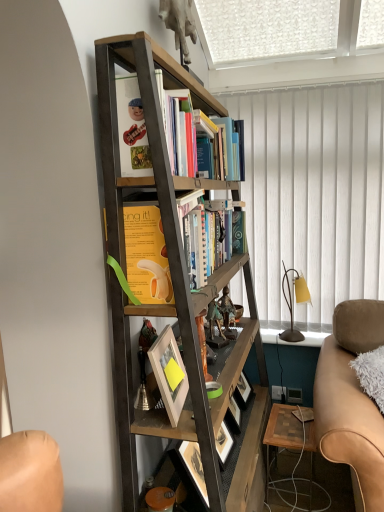
This screenshot has height=512, width=384. Describe the element at coordinates (314, 194) in the screenshot. I see `white textured curtain at upper right` at that location.

The height and width of the screenshot is (512, 384). Identify the location of metallic figurine at center, which is the first toy in back-to-front order. (226, 309).

What do you see at coordinates (226, 309) in the screenshot? The width and height of the screenshot is (384, 512). I see `metallic figurine at center, arranged as the second toy when viewed from the front` at bounding box center [226, 309].

Find the location of a particular element. metallic bookcase at center is located at coordinates (173, 284).

This screenshot has height=512, width=384. I want to click on white textured curtain at upper right, so click(314, 194).

Which is closer, (205, 434) or (328, 448)?

The point (205, 434) is in front.

Which of these two, metallic bookcase at center or suede tan couch at lower right, is smaller?

suede tan couch at lower right is smaller.

Which of these two, metallic bookcase at center or suede tan couch at lower right, stands taller?

With more height is metallic bookcase at center.

Is metallic bookcase at center facing towards suede tan couch at lower right?

Yes, metallic bookcase at center is aimed at suede tan couch at lower right.

From a real-world perspective, between brown matte table lamp at right and white textured curtain at upper right, who is vertically higher?

white textured curtain at upper right is physically above.

In the scene shown: Between brown matte table lamp at right and white textured curtain at upper right, which one appears on the right side from the viewer's perspective?

white textured curtain at upper right.

From the image's perspective, which is above, brown matte table lamp at right or white textured curtain at upper right?

white textured curtain at upper right is shown above in the image.

Choose the correct answer: Is brown matte table lamp at right inside white textured curtain at upper right or outside it?

The correct answer is: outside.

How many degrees apart are the facing directions of white textured curtain at upper right and white matte picture frame at center?

The facing directions of white textured curtain at upper right and white matte picture frame at center are 97.1 degrees apart.

Considering the relative sizes of white textured curtain at upper right and white matte picture frame at center in the image provided, is white textured curtain at upper right smaller than white matte picture frame at center?

Actually, white textured curtain at upper right might be larger than white matte picture frame at center.

Considering the sizes of objects white textured curtain at upper right and white matte picture frame at center in the image provided, who is shorter, white textured curtain at upper right or white matte picture frame at center?

white matte picture frame at center.

Choose the correct answer: Is white textured curtain at upper right inside white matte picture frame at center or outside it?

white textured curtain at upper right lies outside white matte picture frame at center.

Does point (141, 227) come closer to viewer compared to point (291, 300)?

Yes.

Looking at the image, does yellow paperback book at center, the first book viewed from the front, seem bigger or smaller compared to brown matte table lamp at right?

Considering their sizes, yellow paperback book at center, the first book viewed from the front, takes up more space than brown matte table lamp at right.

From a real-world perspective, is yellow paperback book at center, positioned as the 3th book in back-to-front order, positioned above or below brown matte table lamp at right?

In terms of real-world spatial position, yellow paperback book at center, positioned as the 3th book in back-to-front order, is above brown matte table lamp at right.

From the image's perspective, which is below, yellow paperback book at center, the first book viewed from the front, or brown matte table lamp at right?

From the image's view, brown matte table lamp at right is below.

Measure the distance between white textured curtain at upper right and suede tan couch at lower right.

white textured curtain at upper right and suede tan couch at lower right are 28.72 inches apart.

Is white textured curtain at upper right wider than suede tan couch at lower right?

Incorrect, the width of white textured curtain at upper right does not surpass that of suede tan couch at lower right.

Does white textured curtain at upper right have a greater height compared to suede tan couch at lower right?

Correct, white textured curtain at upper right is much taller as suede tan couch at lower right.

From a real-world perspective, which object rests below the other?

From a 3D spatial view, suede tan couch at lower right is below.

Is point (194, 198) positioned before point (337, 353)?

Yes, point (194, 198) is closer to viewer.

How distant is yellow paperback book at center, positioned as the 3th book in back-to-front order, from suede tan couch at lower right?

36.42 inches.

Is yellow paperback book at center, positioned as the 3th book in back-to-front order, situated inside suede tan couch at lower right or outside?

yellow paperback book at center, positioned as the 3th book in back-to-front order, lies outside suede tan couch at lower right.

In the image, there is a yellow paperback book at center, positioned as the 3th book in back-to-front order. Identify the location of picture frame below it (from a real-world perspective). This screenshot has height=512, width=384. (169, 373).

Is white matte picture frame at center outside of yellow paperback book at center, positioned as the 3th book in back-to-front order?

Yes, white matte picture frame at center is outside of yellow paperback book at center, positioned as the 3th book in back-to-front order.

From a real-world perspective, is white matte picture frame at center beneath yellow paperback book at center, positioned as the 3th book in back-to-front order?

Yes, from a real-world perspective, white matte picture frame at center is beneath yellow paperback book at center, positioned as the 3th book in back-to-front order.

Is white matte picture frame at center turned away from yellow paperback book at center, the first book viewed from the front?

No.

Locate an element on the screen. Image resolution: width=384 pixels, height=512 pixels. bookcase that is on the left side of suede tan couch at lower right is located at coordinates (173, 284).

At what (x,y) coordinates should I click in order to perform the action: click on curtain in front of the brown matte table lamp at right. Please return your answer as a coordinate pair (x, y). Looking at the image, I should click on (314, 194).

Based on their spatial positions, is white textured curtain at upper right or hardcover books at center, the 1th book in the back-to-front sequence, further from suede tan couch at lower right?

Based on the image, hardcover books at center, the 1th book in the back-to-front sequence, appears to be further to suede tan couch at lower right.

In the scene shown: Estimate the real-world distances between objects in this image. Which object is closer to bronze figurine at center, marked as the 1th toy in a front-to-back arrangement, hardcover books at center, arranged as the second book when viewed from the back, or yellow paperback book at center, positioned as the 3th book in back-to-front order?

The object closer to bronze figurine at center, marked as the 1th toy in a front-to-back arrangement, is yellow paperback book at center, positioned as the 3th book in back-to-front order.

Considering their positions, is bronze figurine at center, marked as the 2th toy in a back-to-front arrangement, positioned closer to suede tan couch at lower right than white matte picture frame at center?

bronze figurine at center, marked as the 2th toy in a back-to-front arrangement.

Consider the image. Looking at the image, which one is located closer to suede tan couch at lower right, yellow paperback book at center, the first book viewed from the front, or metallic figurine at center, which is the first toy in back-to-front order?

metallic figurine at center, which is the first toy in back-to-front order.

Considering their positions, is metallic figurine at center, arranged as the second toy when viewed from the front, positioned closer to bronze figurine at center, marked as the 1th toy in a front-to-back arrangement, than hardcover books at center, the 1th book in the back-to-front sequence?

metallic figurine at center, arranged as the second toy when viewed from the front, is positioned closer to the anchor bronze figurine at center, marked as the 1th toy in a front-to-back arrangement.

Estimate the real-world distances between objects in this image. Which object is further from wooden/matte table at lower right, white matte picture frame at center or hardcover books at center, the 3th book positioned from the front?

Among the two, hardcover books at center, the 3th book positioned from the front, is located further to wooden/matte table at lower right.

Looking at this image, when comparing their distances from yellow paperback book at center, the first book viewed from the front, does white textured curtain at upper right or suede tan couch at lower right seem further?

white textured curtain at upper right lies further to yellow paperback book at center, the first book viewed from the front, than the other object.

Looking at the image, which one is located closer to metallic bookcase at center, yellow paperback book at center, positioned as the 3th book in back-to-front order, or hardcover books at center, arranged as the second book when viewed from the back?

The object closer to metallic bookcase at center is yellow paperback book at center, positioned as the 3th book in back-to-front order.

At what (x,y) coordinates should I click in order to perform the action: click on table lamp that lies between hardcover books at center, the 3th book positioned from the front, and wooden/matte table at lower right from top to bottom. Please return your answer as a coordinate pair (x, y). The image size is (384, 512). Looking at the image, I should click on (292, 303).

Identify the location of bookcase between hardcover books at center, the 1th book in the back-to-front sequence, and suede tan couch at lower right. (173, 284).

Where is `bookcase between yellow paperback book at center, positioned as the 3th book in back-to-front order, and wooden/matte table at lower right, in the vertical direction`? bookcase between yellow paperback book at center, positioned as the 3th book in back-to-front order, and wooden/matte table at lower right, in the vertical direction is located at coordinates pos(173,284).

Identify the location of table lamp between hardcover books at center, which is the 2th book in front-to-back order, and wooden/matte table at lower right, in the vertical direction. This screenshot has width=384, height=512. (292, 303).